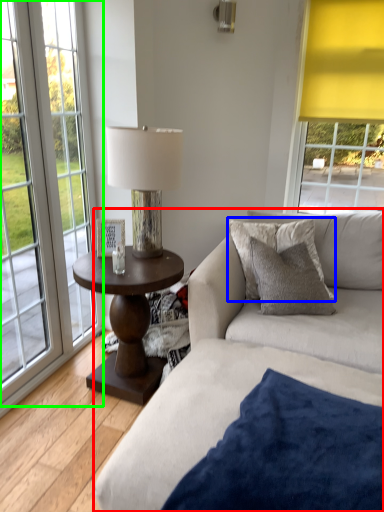
Question: Which object is the closest to the studio couch (highlighted by a red box)? Choose among these: pillow (highlighted by a blue box) or window (highlighted by a green box).

Choices:
 (A) pillow
 (B) window

Answer: (A)